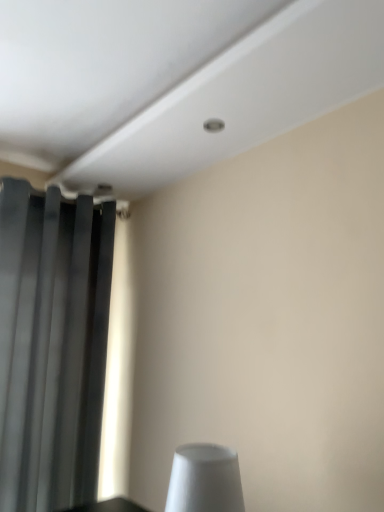
Question: In terms of size, does dark gray matte curtain at left appear bigger or smaller than white matte cone at lower center?

Choices:
 (A) big
 (B) small

Answer: (A)

Question: From a real-world perspective, is dark gray matte curtain at left physically located above or below white matte cone at lower center?

Choices:
 (A) below
 (B) above

Answer: (B)

Question: Considering the positions of point (x=49, y=314) and point (x=178, y=501), is point (x=49, y=314) closer or farther from the camera than point (x=178, y=501)?

Choices:
 (A) farther
 (B) closer

Answer: (A)

Question: Visually, is white matte cone at lower center positioned to the left or to the right of dark gray matte curtain at left?

Choices:
 (A) right
 (B) left

Answer: (A)

Question: From a real-world perspective, relative to dark gray matte curtain at left, is white matte cone at lower center vertically above or below?

Choices:
 (A) above
 (B) below

Answer: (B)

Question: Is point (205, 443) closer or farther from the camera than point (84, 232)?

Choices:
 (A) farther
 (B) closer

Answer: (B)

Question: Would you say white matte cone at lower center is inside or outside dark gray matte curtain at left?

Choices:
 (A) inside
 (B) outside

Answer: (B)